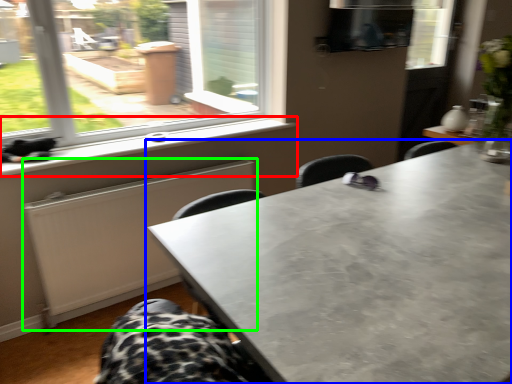
Question: Which object is positioned closest to window sill (highlighted by a red box)? Select from table (highlighted by a blue box) and radiator (highlighted by a green box).

Choices:
 (A) table
 (B) radiator

Answer: (B)